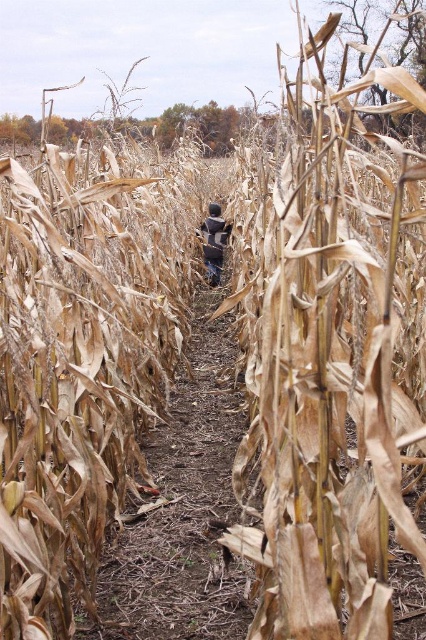
Question: Where is brown dried corn at center located in relation to camouflage-patterned jacket at center in the image?

Choices:
 (A) above
 (B) below

Answer: (B)

Question: Which object is farther from the camera taking this photo?

Choices:
 (A) camouflage-patterned jacket at center
 (B) brown dried corn at center

Answer: (A)

Question: Is brown dried corn at center smaller than camouflage-patterned jacket at center?

Choices:
 (A) no
 (B) yes

Answer: (B)

Question: Among these points, which one is farthest from the camera?

Choices:
 (A) (219, 262)
 (B) (279, 168)

Answer: (A)

Question: Considering the relative positions of brown dried corn at center and camouflage-patterned jacket at center in the image provided, where is brown dried corn at center located with respect to camouflage-patterned jacket at center?

Choices:
 (A) left
 (B) right

Answer: (B)